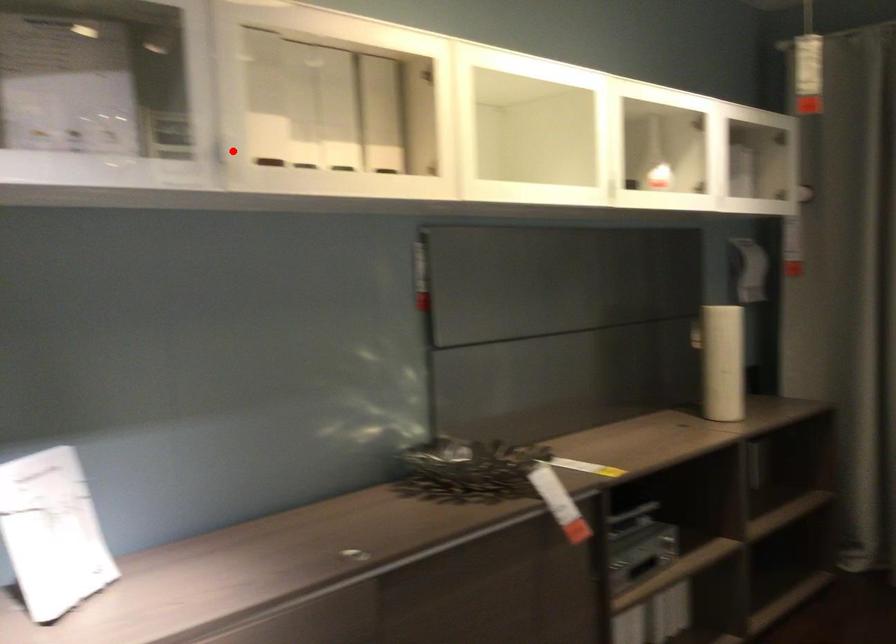
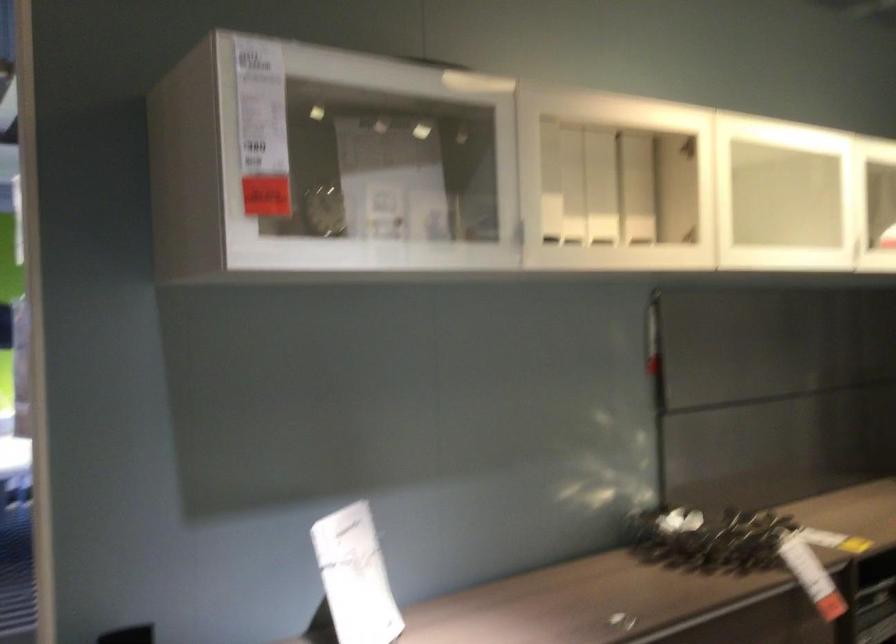
Where in the second image is the point corresponding to the highlighted location from the first image?

(519, 232)